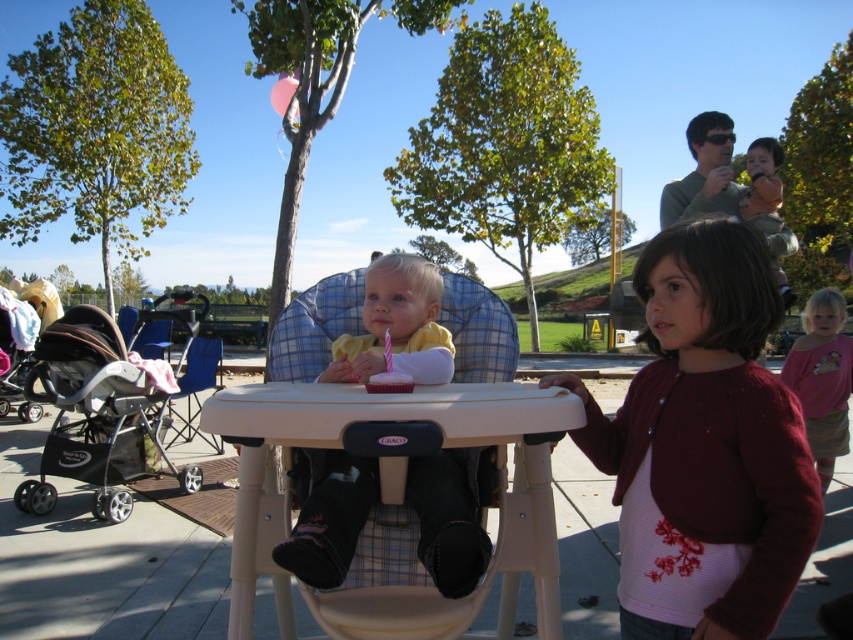
Question: Is pink cotton shirt at lower right thinner than orange cotton shirt at upper right?

Choices:
 (A) no
 (B) yes

Answer: (B)

Question: Among these objects, which one is nearest to the camera?

Choices:
 (A) orange cotton shirt at upper right
 (B) beige plastic high chair at center
 (C) green fabric shirt at upper right
 (D) pink sweater at center

Answer: (B)

Question: Can you confirm if beige plastic high chair at center is thinner than orange cotton shirt at upper right?

Choices:
 (A) yes
 (B) no

Answer: (A)

Question: Can you confirm if beige plastic high chair at center is wider than green fabric shirt at upper right?

Choices:
 (A) yes
 (B) no

Answer: (A)

Question: Among these objects, which one is nearest to the camera?

Choices:
 (A) orange cotton shirt at upper right
 (B) beige plastic high chair at center
 (C) matte yellow shirt at center
 (D) black fabric stroller at left

Answer: (B)

Question: Among these points, which one is farthest from the camera?

Choices:
 (A) (71, 333)
 (B) (770, 156)
 (C) (733, 208)

Answer: (A)